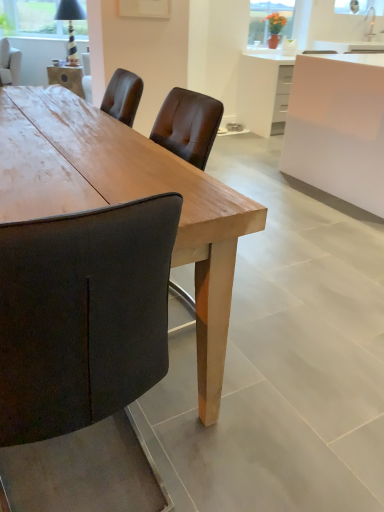
Question: Is wooden table at center completely or partially outside of dark brown leather chair at upper left?

Choices:
 (A) no
 (B) yes

Answer: (B)

Question: Is the position of wooden table at center less distant than that of dark brown leather chair at upper left?

Choices:
 (A) yes
 (B) no

Answer: (A)

Question: Considering the relative positions of wooden table at center and dark brown leather chair at upper left in the image provided, is wooden table at center to the left of dark brown leather chair at upper left from the viewer's perspective?

Choices:
 (A) no
 (B) yes

Answer: (A)

Question: From a real-world perspective, is wooden table at center under dark brown leather chair at upper left?

Choices:
 (A) no
 (B) yes

Answer: (B)

Question: Is wooden table at center not close to dark brown leather chair at upper left?

Choices:
 (A) no
 (B) yes

Answer: (B)

Question: Considering the relative sizes of wooden table at center and dark brown leather chair at upper left in the image provided, is wooden table at center smaller than dark brown leather chair at upper left?

Choices:
 (A) no
 (B) yes

Answer: (A)

Question: Does white glossy cabinet at upper right have a lesser height compared to dark brown leather chair at upper left?

Choices:
 (A) yes
 (B) no

Answer: (B)

Question: Does white glossy cabinet at upper right appear on the right side of dark brown leather chair at upper left?

Choices:
 (A) no
 (B) yes

Answer: (B)

Question: From a real-world perspective, is white glossy cabinet at upper right over dark brown leather chair at upper left?

Choices:
 (A) yes
 (B) no

Answer: (B)

Question: Is white glossy cabinet at upper right oriented away from dark brown leather chair at upper left?

Choices:
 (A) no
 (B) yes

Answer: (A)

Question: Is white glossy cabinet at upper right in contact with dark brown leather chair at upper left?

Choices:
 (A) no
 (B) yes

Answer: (A)

Question: From a real-world perspective, is white glossy cabinet at upper right located beneath dark brown leather chair at upper left?

Choices:
 (A) yes
 (B) no

Answer: (A)

Question: From the image's perspective, is white glossy cabinet at upper right on top of matte glass vase at upper center?

Choices:
 (A) yes
 (B) no

Answer: (B)